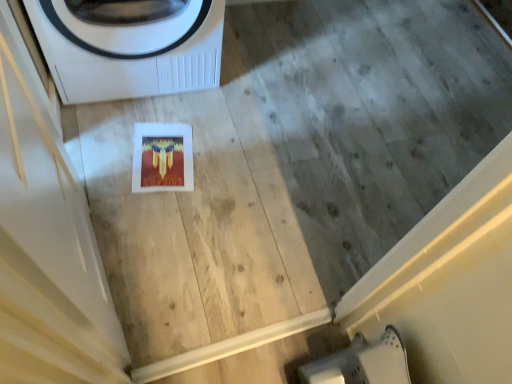
Locate an element on the screen. This screenshot has height=384, width=512. spots to the right of white plastic washing machine at upper left is located at coordinates coord(261,89).